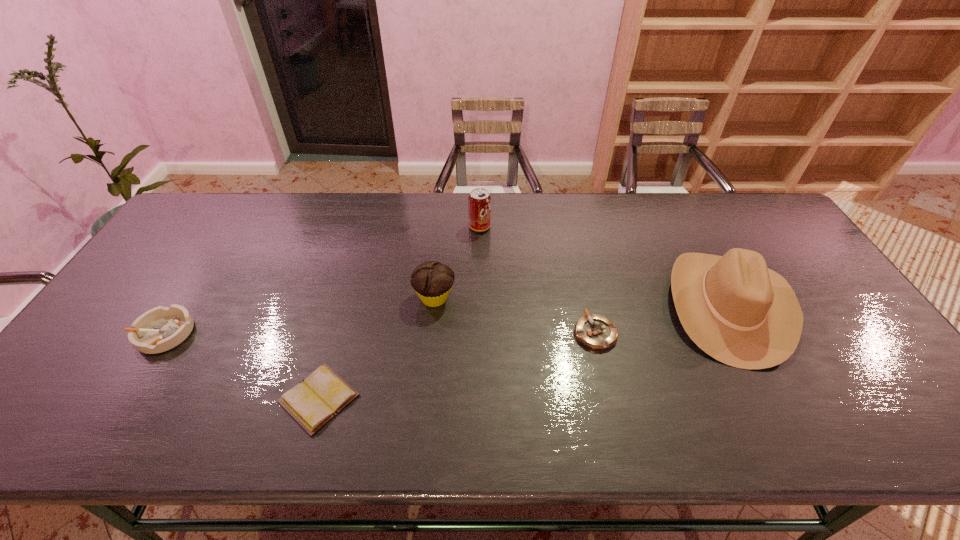
Where is `cowboy hat`? Image resolution: width=960 pixels, height=540 pixels. cowboy hat is located at coordinates (743, 314).

Where is `the rightmost object`? The image size is (960, 540). the rightmost object is located at coordinates (743, 314).

Identify the location of the farthest object. Image resolution: width=960 pixels, height=540 pixels. (479, 201).

You are a GUI agent. You are given a task and a screenshot of the screen. Output one action in this format:
    pyautogui.click(x=<x>, y=<y>)
    Task: Click on the third object from right to left
    This screenshot has width=960, height=540.
    Given the screenshot: What is the action you would take?
    pyautogui.click(x=479, y=201)

Find the location of a particular element. Image resolution: width=960 pixels, height=540 pixels. muffin is located at coordinates (432, 281).

Where is `the third object from left to right`? The width and height of the screenshot is (960, 540). the third object from left to right is located at coordinates (432, 281).

Where is `the leftmost object`? Image resolution: width=960 pixels, height=540 pixels. the leftmost object is located at coordinates (160, 329).

This screenshot has height=540, width=960. In order to click on the left ashtray in this screenshot , I will do `click(160, 329)`.

This screenshot has height=540, width=960. What are the coordinates of `the right ashtray` in the screenshot? It's located at (594, 331).

Find the location of a particular element. The width and height of the screenshot is (960, 540). the fifth object from left to right is located at coordinates (594, 331).